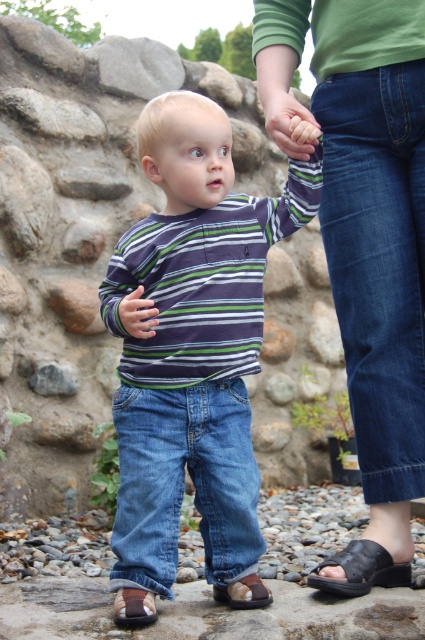
You are a photographer trying to capture a closeup of the striped cotton shirt at center and the matte black ring at center in the image. Given that your camera can focus on objects within a 9 inch range, will both items be in focus?

The striped cotton shirt at center and matte black ring at center are 10.03 inches apart, which exceeds the camera focus range of 9 inches. Thus, both items cannot be in focus simultaneously.